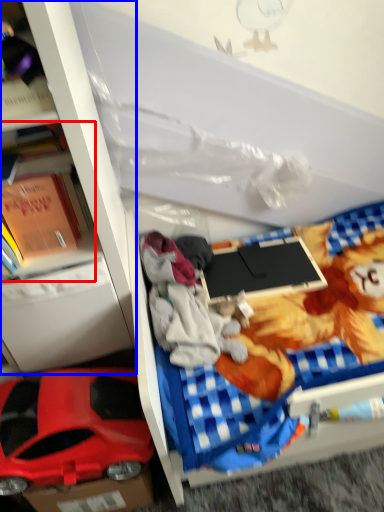
Question: Which object is closer to the camera taking this photo, book (highlighted by a red box) or bookshelf (highlighted by a blue box)?

Choices:
 (A) book
 (B) bookshelf

Answer: (B)